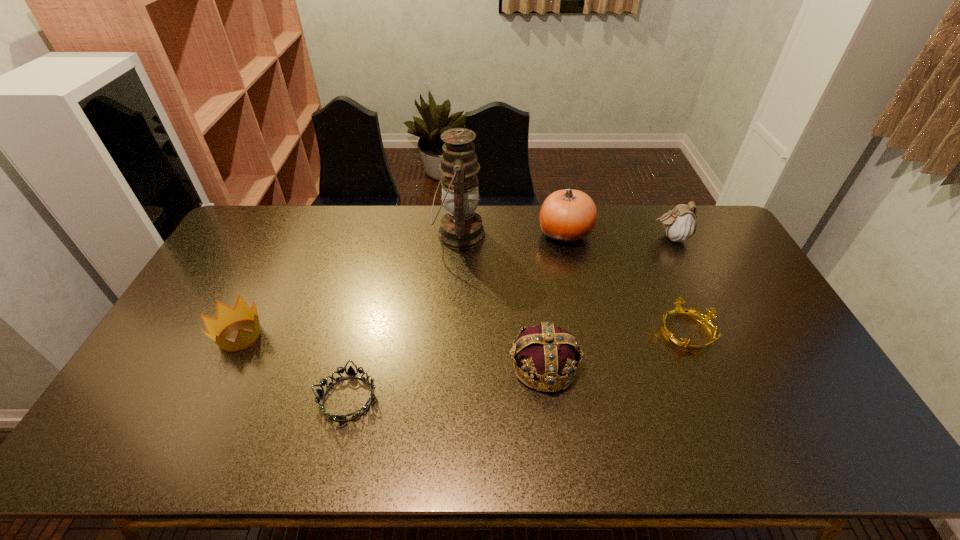
Locate an element on the screen. The width and height of the screenshot is (960, 540). vacant space located 0.060m on the back of the pumpkin is located at coordinates (560, 207).

Image resolution: width=960 pixels, height=540 pixels. I want to click on vacant area situated 0.110m on the front-facing side of the pouch, so click(622, 238).

The width and height of the screenshot is (960, 540). I want to click on free point located on the front-facing side of the pouch, so click(622, 238).

At what (x,y) coordinates should I click in order to perform the action: click on vacant region located 0.290m on the front-facing side of the pouch. Please return your answer as a coordinate pair (x, y). Looking at the image, I should click on (572, 238).

Locate an element on the screen. Image resolution: width=960 pixels, height=540 pixels. free spot located 0.200m on the right of the second crown from right to left is located at coordinates (654, 366).

Locate an element on the screen. The height and width of the screenshot is (540, 960). vacant region located 0.350m on the right of the third shortest object is located at coordinates (386, 335).

Where is `free space located on the back of the rightmost crown`? free space located on the back of the rightmost crown is located at coordinates (659, 267).

Where is `blank area located on the front-facing side of the tiara`? blank area located on the front-facing side of the tiara is located at coordinates (449, 398).

I want to click on lantern positioned at the far edge, so click(461, 228).

I want to click on pumpkin at the far edge, so click(x=567, y=216).